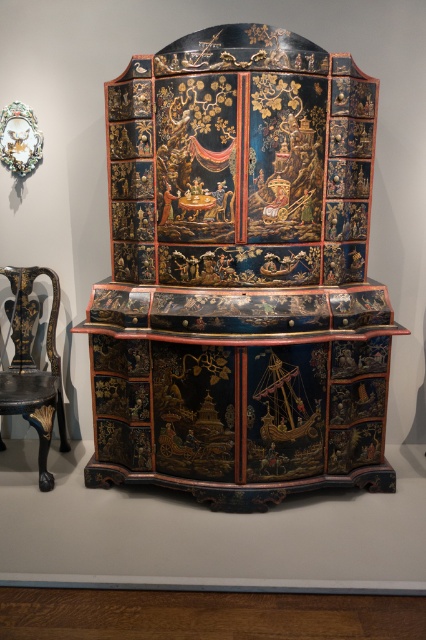
Where is `glossy lacquered cabinet at center`? This screenshot has height=640, width=426. glossy lacquered cabinet at center is located at coordinates (239, 275).

Based on the photo, how much distance is there between glossy lacquered cabinet at center and glossy black wood chair at left?

A distance of 33.55 inches exists between glossy lacquered cabinet at center and glossy black wood chair at left.

Is point (195, 300) closer to viewer compared to point (0, 403)?

Yes, it is in front of point (0, 403).

This screenshot has height=640, width=426. I want to click on glossy lacquered cabinet at center, so click(239, 275).